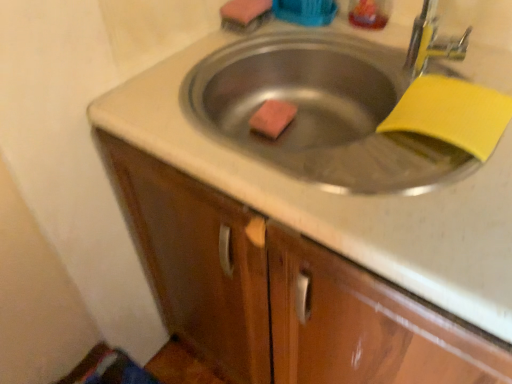
Where is `free location to the left of translucent plastic liquid at upper right`? free location to the left of translucent plastic liquid at upper right is located at coordinates (311, 30).